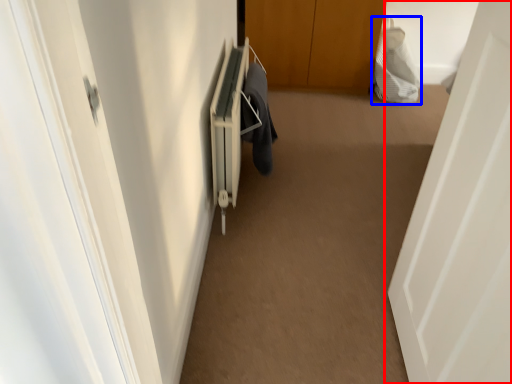
Question: Which of the following is the closest to the observer, door (highlighted by a red box) or material (highlighted by a blue box)?

Choices:
 (A) door
 (B) material

Answer: (A)